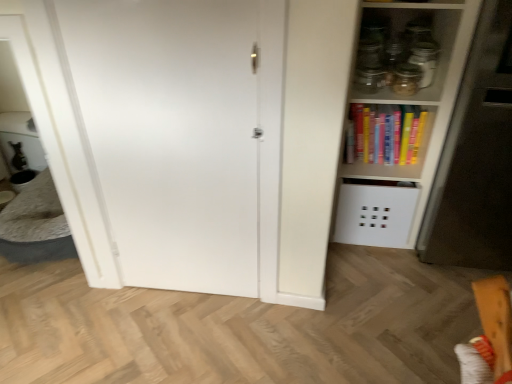
Identify the location of vacant area in front of white glossy table at left. This screenshot has width=512, height=384. (54, 312).